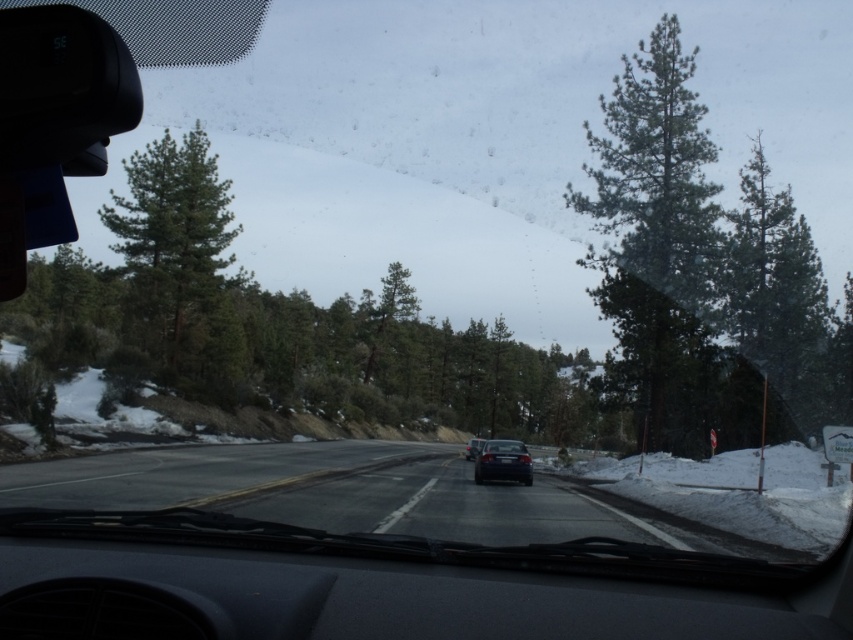
You are driving on a snowy road and notice two points marked on your windshield. The first point is at coordinate point (x=795, y=412) and the second is at point (x=529, y=461). Which point is closer to the front of the car?

Point (x=529, y=461) is closer to the front of the car because it is in front of point (x=795, y=412) according to their positions on the windshield.

You are a passenger in the vehicle and want to know which of the two points, point (x=608, y=172) or point (x=744, y=285), is closer to the windshield. Based on the scene description, can you determine which point is nearer to the windshield?

Point (x=608, y=172) is further to the camera than point (x=744, y=285), so the point closer to the windshield is point (x=744, y=285).